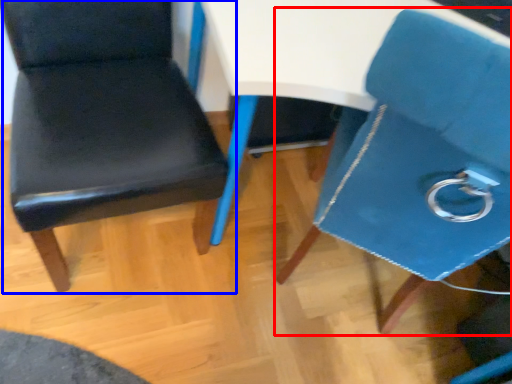
Question: Which object appears farthest to the camera in this image, chair (highlighted by a red box) or chair (highlighted by a blue box)?

Choices:
 (A) chair
 (B) chair

Answer: (B)